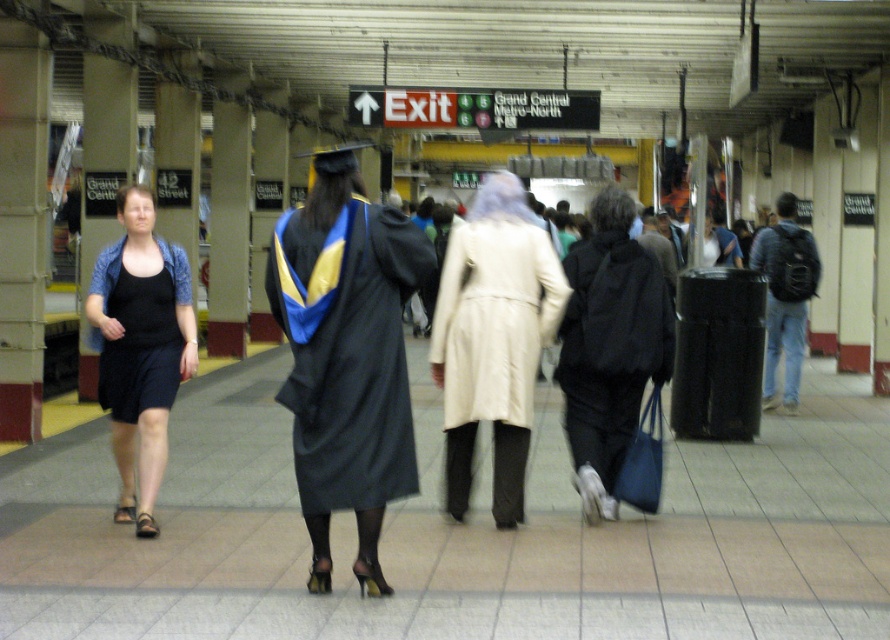
Is the position of matte black gown at center less distant than that of black matte dress at center?

Yes, it is in front of black matte dress at center.

Who is more distant from viewer, (417,266) or (193,333)?

Point (193,333)

Where is `matte black gown at center`? Image resolution: width=890 pixels, height=640 pixels. matte black gown at center is located at coordinates (356, 369).

Is point (541, 316) behind point (130, 417)?

Yes, it is.

Does beige fabric coat at center appear under black matte dress at left?

Incorrect, beige fabric coat at center is not positioned below black matte dress at left.

Is point (484, 416) more distant than point (109, 244)?

No, (484, 416) is in front of (109, 244).

Where is `beige fabric coat at center`? Image resolution: width=890 pixels, height=640 pixels. beige fabric coat at center is located at coordinates (492, 339).

Is beige fabric coat at center thinner than denim jeans at right?

Yes.

Does beige fabric coat at center have a larger size compared to denim jeans at right?

Actually, beige fabric coat at center might be smaller than denim jeans at right.

Image resolution: width=890 pixels, height=640 pixels. What are the coordinates of `beige fabric coat at center` in the screenshot? It's located at (492, 339).